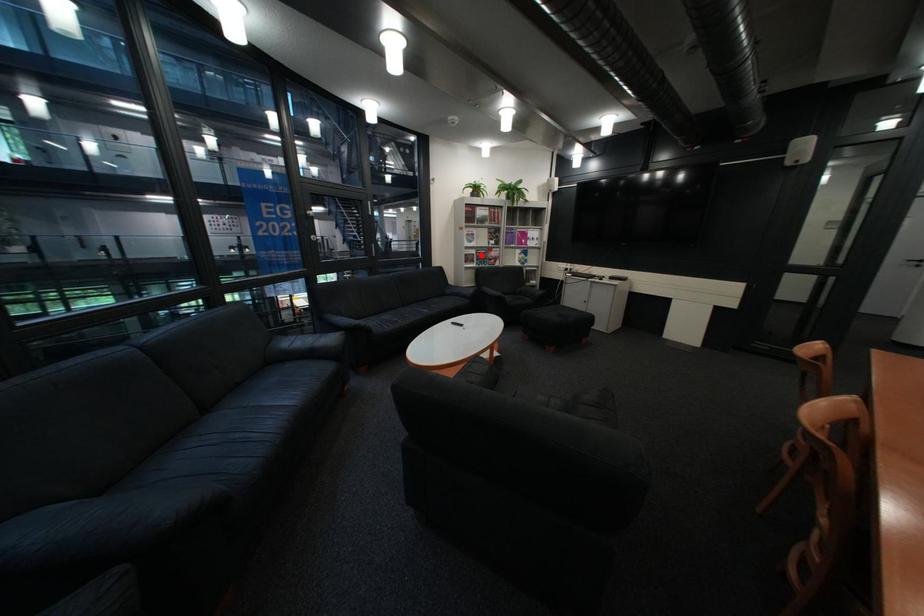
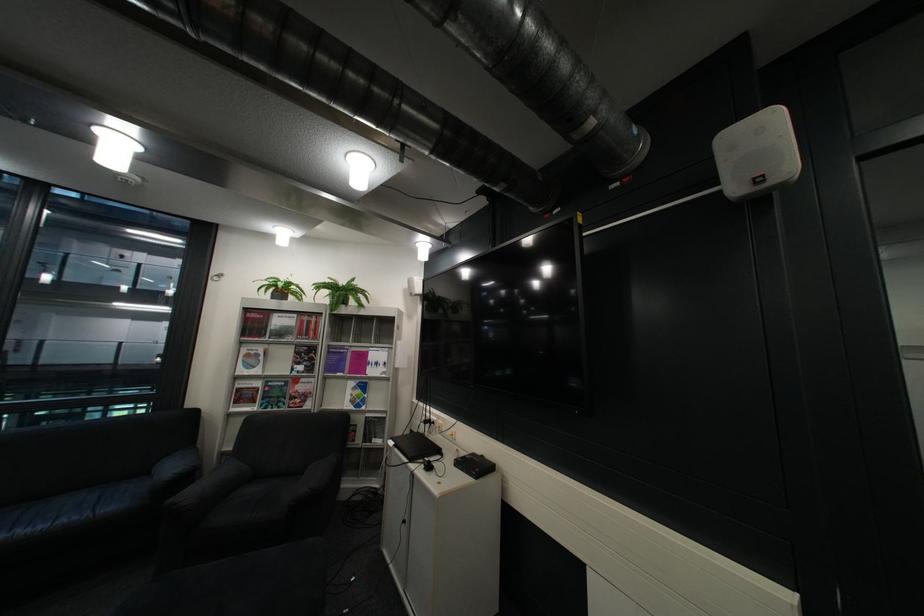
Question: A red point is marked in image1. In image2, is the corresponding 3D point closer to the camera or farther? Reply with the corresponding letter.

Choices:
 (A) The corresponding 3D point is closer.
 (B) The corresponding 3D point is farther.

Answer: (B)